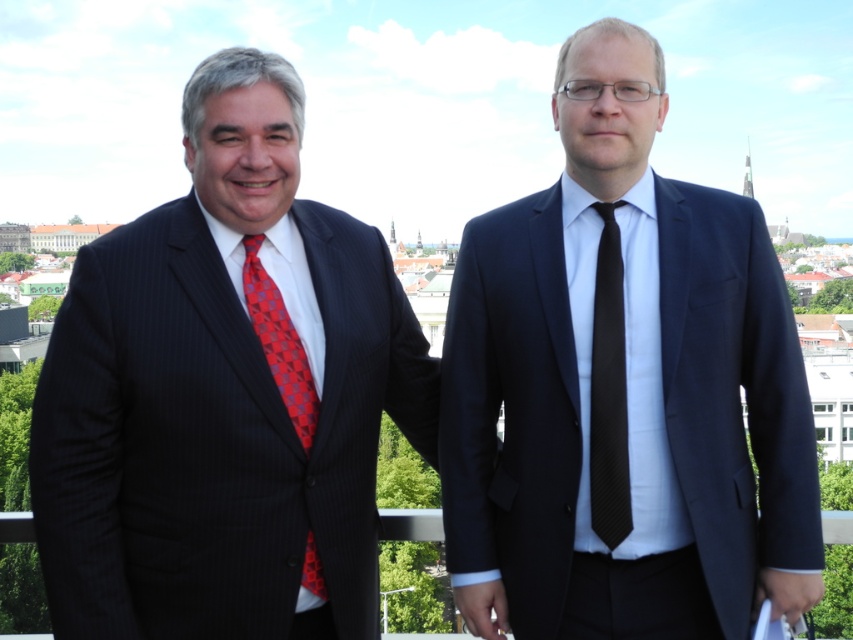
You are a photographer trying to capture a closeup shot of the black textured tie at center. You are standing behind the matte black suit at right. Can you take the photo without moving either subject?

The matte black suit at right is above the black textured tie at center, so you can take the photo without moving either subject by positioning yourself below the matte black suit at right to get a clear view of the black textured tie at center.

You are a photographer trying to capture a closeup of the matte black suit at right and the black textured tie at center. Since your camera can only focus on one object at a time, which object should you focus on to ensure it appears larger in the photo?

The matte black suit at right is wider than the black textured tie at center, so focusing on the matte black suit at right will make it appear larger in the photo.

You are a photographer trying to capture a clear shot of both the matte black suit at right and the red checkered tie at left. Since you want to ensure both are visible in the frame, which object should you focus on first to account for their size differences?

The matte black suit at right is bigger than the red checkered tie at left, so you should focus on the matte black suit at right first to ensure its details are captured clearly before adjusting for the smaller red checkered tie at left.